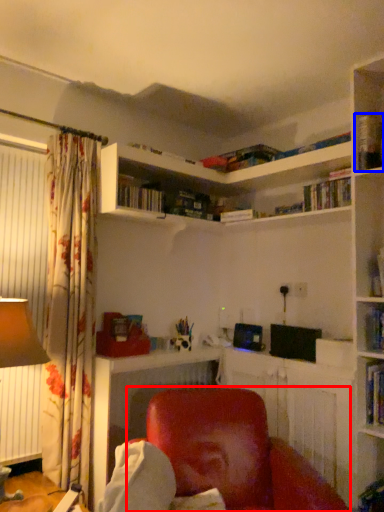
Question: Among these objects, which one is nearest to the camera, chair (highlighted by a red box) or book (highlighted by a blue box)?

Choices:
 (A) chair
 (B) book

Answer: (A)